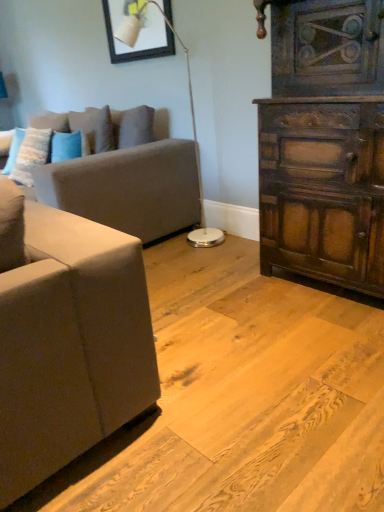
This screenshot has width=384, height=512. I want to click on vacant space that is to the left of dark brown wood chest of drawers at right, so click(x=225, y=294).